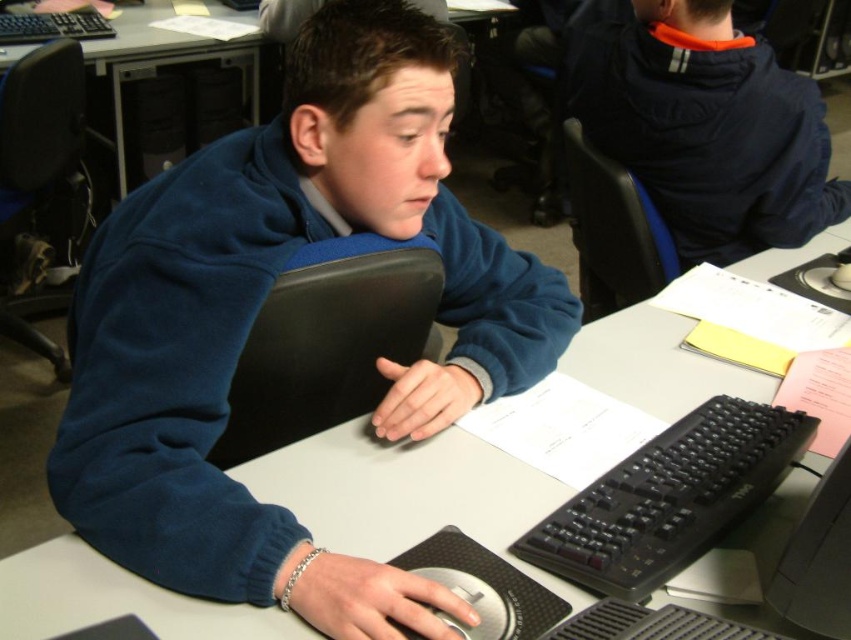
Question: Which of the following is the farthest from the observer?

Choices:
 (A) (745, 268)
 (B) (92, 29)
 (C) (323, 161)
 (D) (652, 61)

Answer: (B)

Question: Which object is farther from the camera taking this photo?

Choices:
 (A) black plastic keyboard at center
 (B) blue fleece jacket at center

Answer: (A)

Question: Which point is closer to the camera?

Choices:
 (A) black plastic keyboard at upper left
 (B) blue fleece jacket at center

Answer: (B)

Question: From the image, what is the correct spatial relationship of black plastic keyboard at lower center in relation to black plastic keyboard at upper left?

Choices:
 (A) above
 (B) below

Answer: (B)

Question: Can you confirm if dark blue fleece jacket at upper right is positioned above black plastic keyboard at lower center?

Choices:
 (A) yes
 (B) no

Answer: (A)

Question: Does dark blue fleece jacket at upper right come in front of black plastic keyboard at lower center?

Choices:
 (A) no
 (B) yes

Answer: (A)